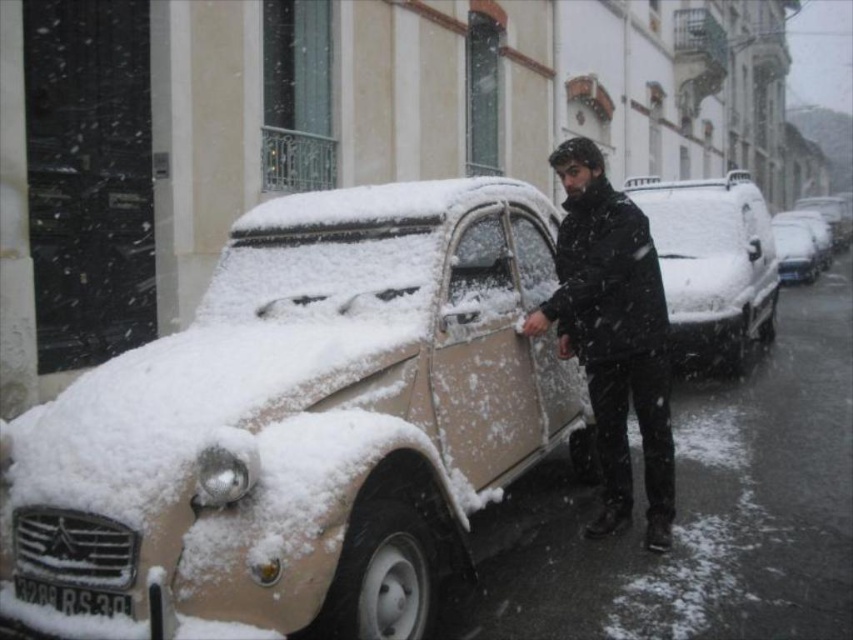
You are a photographer trying to capture the beige matte car at center and the black matte jacket at center in a single shot. Since the camera can only focus on one object at a time, which object should you choose to ensure the other remains in the background?

The beige matte car at center is closer to the viewer than the black matte jacket at center, so if you focus on the car, the jacket will be in the background. Alternatively, focusing on the jacket would leave the car out of focus. To include both, adjust the aperture for a deeper depth of field.